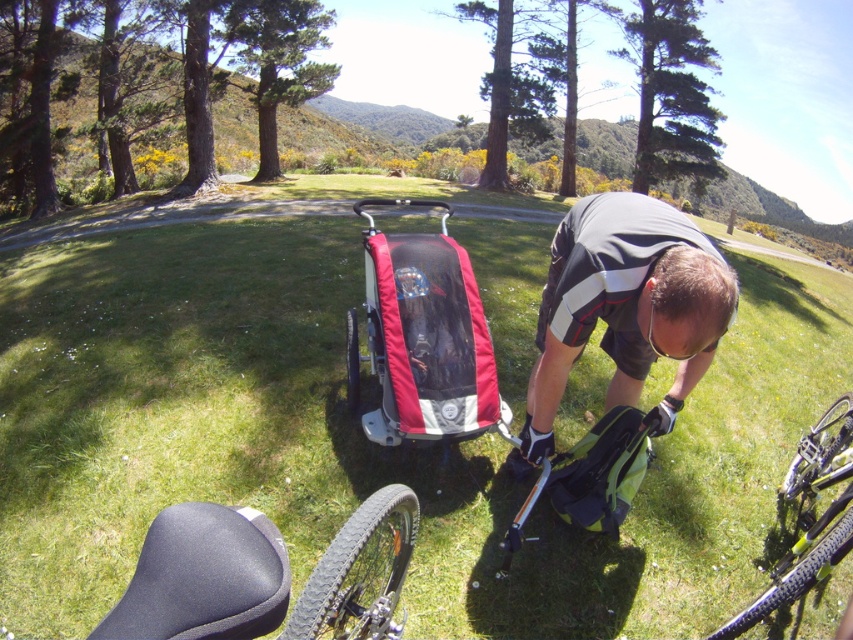
You are planning to set up a small picnic area in the image. You have a picnic blanket that covers the entire green grass at center. Will the black matte seat at lower left also be covered by the blanket?

The green grass at center is larger in size than the black matte seat at lower left, so the picnic blanket covering the green grass at center would also cover the black matte seat at lower left.

You are a person standing at the edge of the scene. You need to walk to the yellow matte bicycle at lower right but must avoid stepping on the green grass at center. Which direction should you walk to reach the bicycle without stepping on the grass?

The green grass at center is to the left of the yellow matte bicycle at lower right, so you should walk to the right side of the bicycle to avoid stepping on the grass.